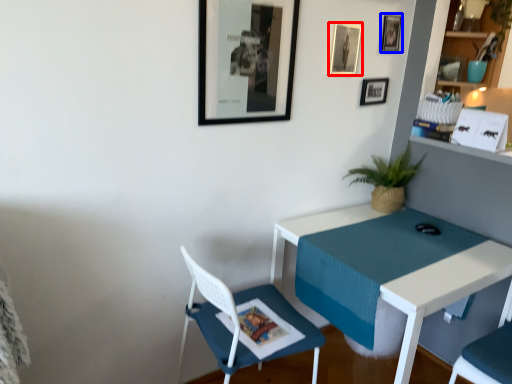
Question: Which point is closer to the camera, picture frame (highlighted by a red box) or picture frame (highlighted by a blue box)?

Choices:
 (A) picture frame
 (B) picture frame

Answer: (A)